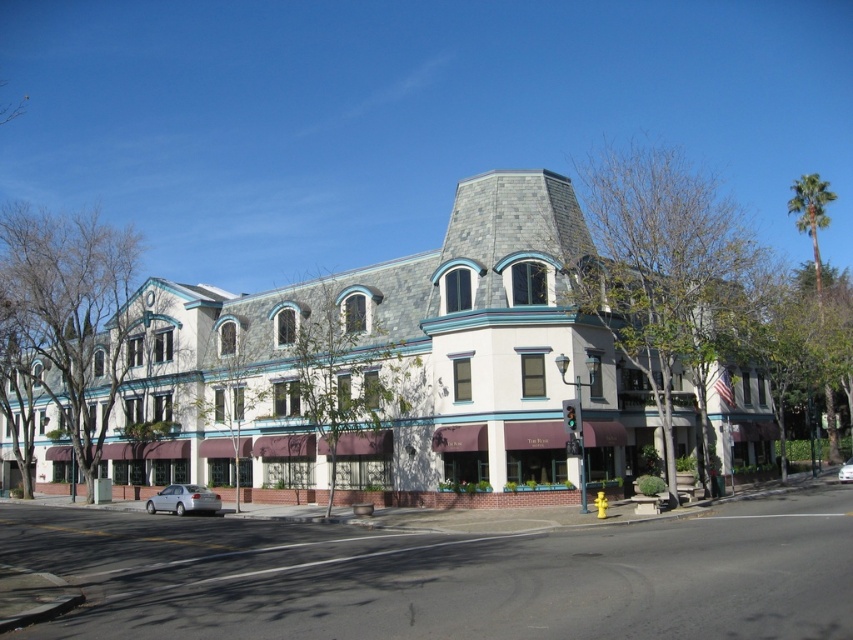
Question: Considering the relative positions of silver metallic sedan at lower left and silver metallic car at center in the image provided, where is silver metallic sedan at lower left located with respect to silver metallic car at center?

Choices:
 (A) left
 (B) right

Answer: (A)

Question: Does silver metallic sedan at lower left have a smaller size compared to silver metallic car at center?

Choices:
 (A) no
 (B) yes

Answer: (B)

Question: Among these points, which one is nearest to the camera?

Choices:
 (A) (215, 508)
 (B) (846, 468)
 (C) (428, 448)

Answer: (C)

Question: Which of the following is the farthest from the observer?

Choices:
 (A) (184, 492)
 (B) (351, 320)
 (C) (844, 461)

Answer: (C)

Question: Is white stone building at center positioned behind silver metallic sedan at lower left?

Choices:
 (A) yes
 (B) no

Answer: (B)

Question: Which point is closer to the camera?

Choices:
 (A) (844, 477)
 (B) (184, 493)

Answer: (B)